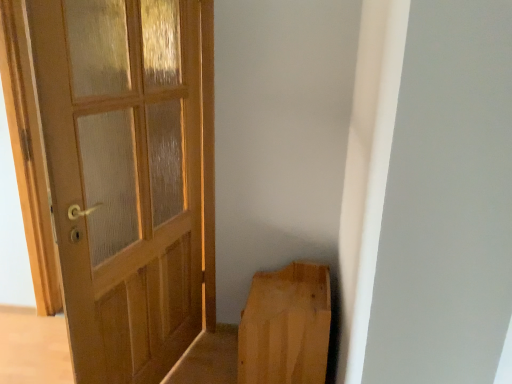
Question: Can you confirm if light brown wood at lower right is positioned to the right of wooden door at left?

Choices:
 (A) no
 (B) yes

Answer: (B)

Question: From the image's perspective, is light brown wood at lower right under wooden door at left?

Choices:
 (A) yes
 (B) no

Answer: (A)

Question: From a real-world perspective, is light brown wood at lower right physically below wooden door at left?

Choices:
 (A) no
 (B) yes

Answer: (B)

Question: Can you confirm if light brown wood at lower right is positioned to the left of wooden door at left?

Choices:
 (A) yes
 (B) no

Answer: (B)

Question: Is light brown wood at lower right located outside wooden door at left?

Choices:
 (A) no
 (B) yes

Answer: (B)

Question: Does light brown wood at lower right have a greater height compared to wooden door at left?

Choices:
 (A) yes
 (B) no

Answer: (B)

Question: Is wooden door at left looking in the opposite direction of light brown wood at lower right?

Choices:
 (A) no
 (B) yes

Answer: (B)

Question: From the image's perspective, would you say wooden door at left is positioned over light brown wood at lower right?

Choices:
 (A) yes
 (B) no

Answer: (A)

Question: Is wooden door at left at the right side of light brown wood at lower right?

Choices:
 (A) yes
 (B) no

Answer: (B)

Question: Considering the relative sizes of wooden door at left and light brown wood at lower right in the image provided, is wooden door at left bigger than light brown wood at lower right?

Choices:
 (A) yes
 (B) no

Answer: (A)

Question: Considering the relative sizes of wooden door at left and light brown wood at lower right in the image provided, is wooden door at left taller than light brown wood at lower right?

Choices:
 (A) no
 (B) yes

Answer: (B)

Question: Is wooden door at left not within light brown wood at lower right?

Choices:
 (A) no
 (B) yes

Answer: (B)

Question: Is point (279, 375) closer or farther from the camera than point (136, 226)?

Choices:
 (A) closer
 (B) farther

Answer: (B)